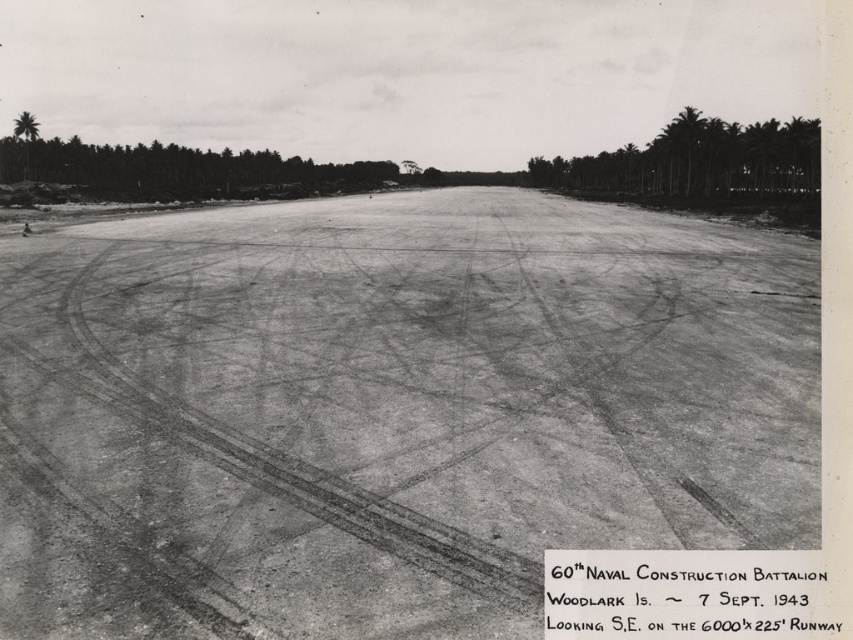
Which of these two, dirt at center or green leafy trees at upper right, stands shorter?

dirt at center is shorter.

Can you confirm if dirt at center is positioned to the left of green leafy trees at upper right?

Correct, you'll find dirt at center to the left of green leafy trees at upper right.

The width and height of the screenshot is (853, 640). Describe the element at coordinates (389, 412) in the screenshot. I see `dirt at center` at that location.

You are a GUI agent. You are given a task and a screenshot of the screen. Output one action in this format:
    pyautogui.click(x=<x>, y=<y>)
    Task: Click on the dirt at center
    
    Given the screenshot: What is the action you would take?
    389,412

Who is positioned more to the right, dirt at center or green leafy palm tree at upper left?

dirt at center is more to the right.

The width and height of the screenshot is (853, 640). Describe the element at coordinates (389, 412) in the screenshot. I see `dirt at center` at that location.

The image size is (853, 640). Describe the element at coordinates (389, 412) in the screenshot. I see `dirt at center` at that location.

I want to click on dirt at center, so click(x=389, y=412).

Is green leafy trees at upper right further to the viewer compared to green leafy palm tree at upper left?

No, green leafy trees at upper right is closer to the viewer.

Can you confirm if green leafy trees at upper right is positioned to the right of green leafy palm tree at upper left?

Yes, green leafy trees at upper right is to the right of green leafy palm tree at upper left.

Who is more forward, (608,193) or (19,134)?

Point (19,134) is in front.

Identify the location of green leafy trees at upper right. point(695,163).